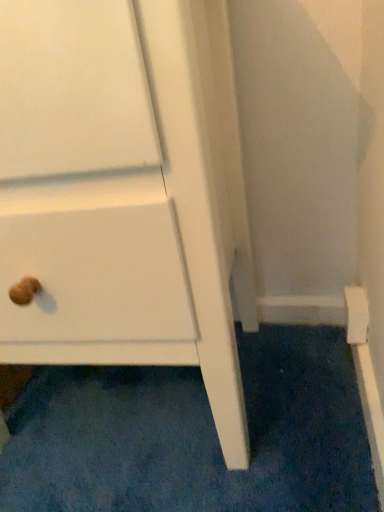
Describe the element at coordinates (125, 192) in the screenshot. I see `white matte cabinet at lower left` at that location.

The width and height of the screenshot is (384, 512). Find the location of `white matte cabinet at lower left`. white matte cabinet at lower left is located at coordinates (125, 192).

The width and height of the screenshot is (384, 512). I want to click on white matte cabinet at lower left, so click(x=125, y=192).